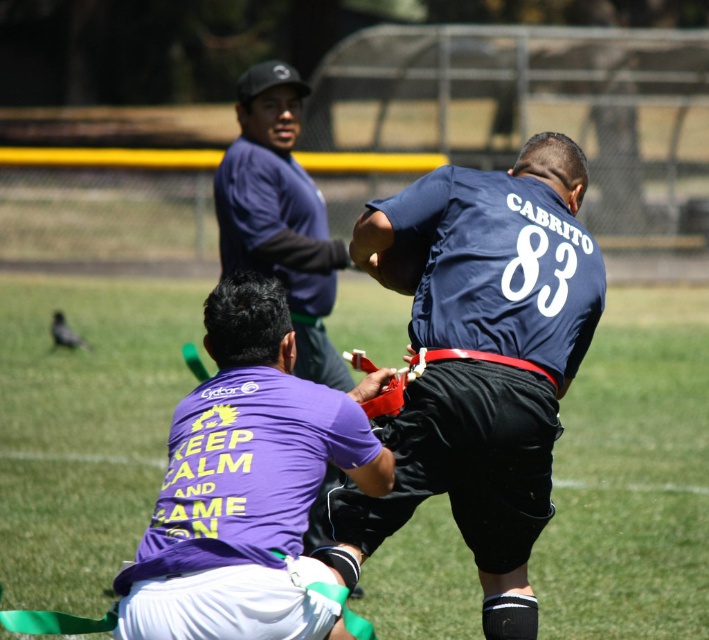
Who is lower down, purple fabric shirt at center or matte blue jersey at upper center?

purple fabric shirt at center is below.

Which of these two, purple fabric shirt at center or matte blue jersey at upper center, stands taller?

matte blue jersey at upper center is taller.

Is point (576, 556) positioned after point (228, 198)?

Yes, it is behind point (228, 198).

Where is `purple fabric shirt at center`? This screenshot has width=709, height=640. purple fabric shirt at center is located at coordinates (84, 428).

Does navy blue jersey at center come behind matte blue jersey at upper center?

No, navy blue jersey at center is closer to the viewer.

Between navy blue jersey at center and matte blue jersey at upper center, which one has less height?

matte blue jersey at upper center

Does point (547, 333) come in front of point (252, 115)?

Yes, it is in front of point (252, 115).

Identify the location of navy blue jersey at center. (484, 358).

Is purple fabric shirt at center to the left of navy blue jersey at center from the viewer's perspective?

Yes, purple fabric shirt at center is to the left of navy blue jersey at center.

Can you confirm if purple fabric shirt at center is smaller than navy blue jersey at center?

Yes, purple fabric shirt at center is smaller than navy blue jersey at center.

Describe the element at coordinates (84, 428) in the screenshot. The image size is (709, 640). I see `purple fabric shirt at center` at that location.

I want to click on purple fabric shirt at center, so click(84, 428).